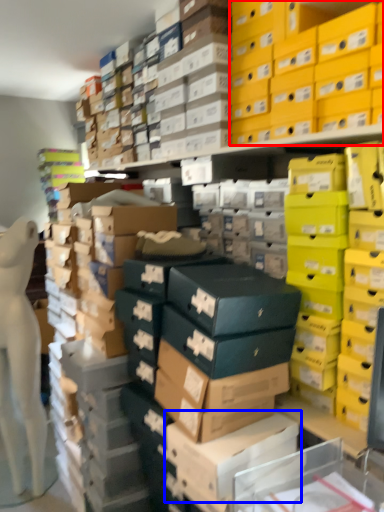
Question: Which point is further to the camera, storage box (highlighted by a red box) or cardboard box (highlighted by a blue box)?

Choices:
 (A) storage box
 (B) cardboard box

Answer: (A)